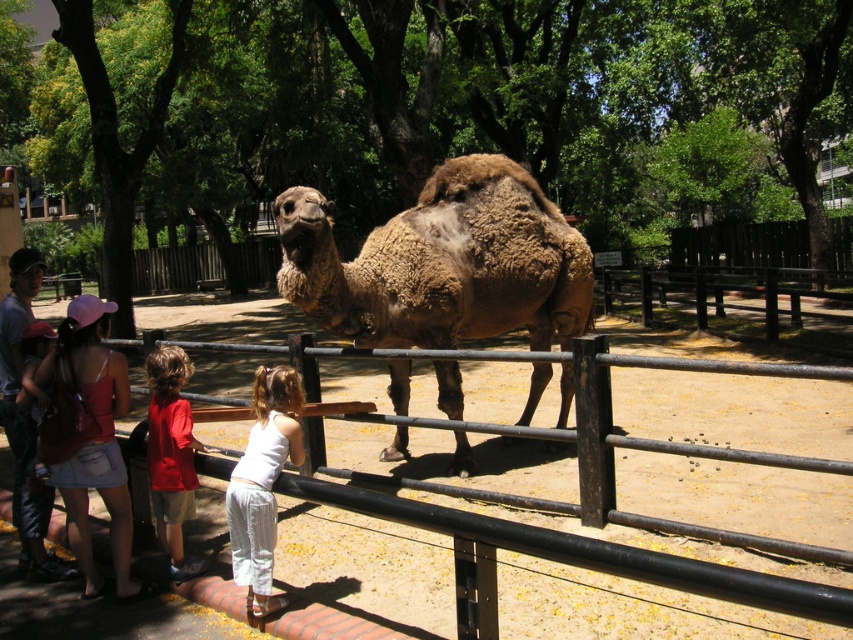
I want to click on fuzzy brown camel at center, so click(x=442, y=262).

Is fuzzy brown camel at center taller than red cotton shirt at center?

In fact, fuzzy brown camel at center may be shorter than red cotton shirt at center.

Locate an element on the screen. fuzzy brown camel at center is located at coordinates 442,262.

At what (x,y) coordinates should I click in order to perform the action: click on fuzzy brown camel at center. Please return your answer as a coordinate pair (x, y). The width and height of the screenshot is (853, 640). Looking at the image, I should click on (442, 262).

Who is shorter, fuzzy brown camel at center or white striped pants at lower center?

fuzzy brown camel at center is shorter.

Who is positioned more to the left, fuzzy brown camel at center or white striped pants at lower center?

Positioned to the left is white striped pants at lower center.

I want to click on fuzzy brown camel at center, so click(442, 262).

Is black metal fence at center to the left of red cotton shirt at center from the viewer's perspective?

No, black metal fence at center is not to the left of red cotton shirt at center.

Based on the photo, which is above, black metal fence at center or red cotton shirt at center?

Positioned higher is red cotton shirt at center.

This screenshot has height=640, width=853. Describe the element at coordinates (366, 564) in the screenshot. I see `black metal fence at center` at that location.

The height and width of the screenshot is (640, 853). In order to click on black metal fence at center in this screenshot , I will do `click(366, 564)`.